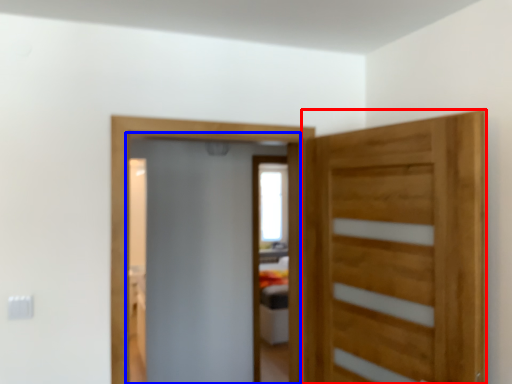
Question: Among these objects, which one is nearest to the camera, door (highlighted by a red box) or screen door (highlighted by a blue box)?

Choices:
 (A) door
 (B) screen door

Answer: (A)